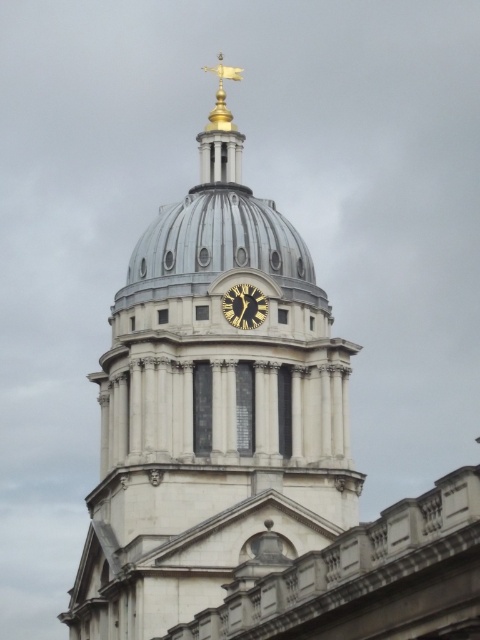
You are an architect reviewing blueprints of a building. You notice the white stone dome at center and the gold metallic clock at center. According to the description, which object is positioned higher in the structure?

The gold metallic clock at center is positioned higher than the white stone dome at center because the white stone dome at center is below the gold metallic clock at center.

You are an architect reviewing the design of this historical building. You notice the white stone dome at center and the gold metallic clock at center. Based on their positions, which one is located to the left?

The white stone dome at center is to the left of the gold metallic clock at center, so the white stone dome at center is located to the left.

You are an architect analyzing the placement of the gold polished metal weather vane at upper center in the image. What are the coordinates of its position?

The coordinates of the gold polished metal weather vane at upper center are at point (220, 132).